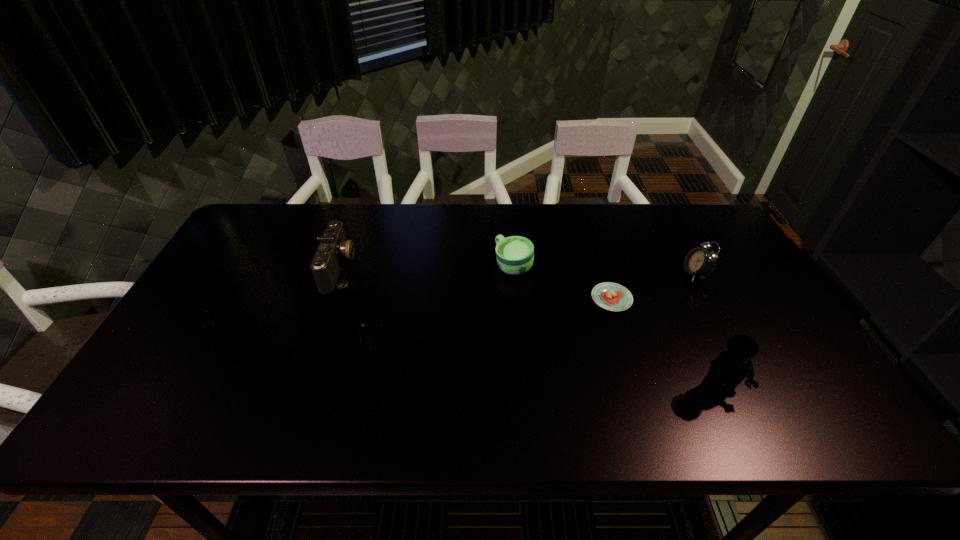
Where is `object that is at the far edge`? This screenshot has width=960, height=540. object that is at the far edge is located at coordinates (327, 263).

Identify the location of object at the left edge. Image resolution: width=960 pixels, height=540 pixels. (212, 318).

You are a GUI agent. You are given a task and a screenshot of the screen. Output one action in this format:
    pyautogui.click(x=<x>, y=<y>)
    Task: Click on the object that is at the right edge
    Image resolution: width=960 pixels, height=540 pixels.
    Given the screenshot: What is the action you would take?
    pyautogui.click(x=699, y=262)

The width and height of the screenshot is (960, 540). In the image, there is a desktop. In order to click on vacant area at the far edge in this screenshot , I will do `click(632, 221)`.

Image resolution: width=960 pixels, height=540 pixels. I want to click on vacant area at the near edge, so click(575, 390).

Identify the location of free space at the far left corner. This screenshot has width=960, height=540. (255, 225).

Find the location of `blank space at the near left corner of the desktop`. blank space at the near left corner of the desktop is located at coordinates (190, 395).

The height and width of the screenshot is (540, 960). Identify the location of vacant space at the far right corner. (684, 228).

Locate an element on the screen. Image resolution: width=960 pixels, height=540 pixels. vacant area that lies between the pastry and the alarm clock is located at coordinates (654, 286).

In order to click on vacant area that lies between the alarm clock and the nearest Lego in this screenshot , I will do `click(707, 333)`.